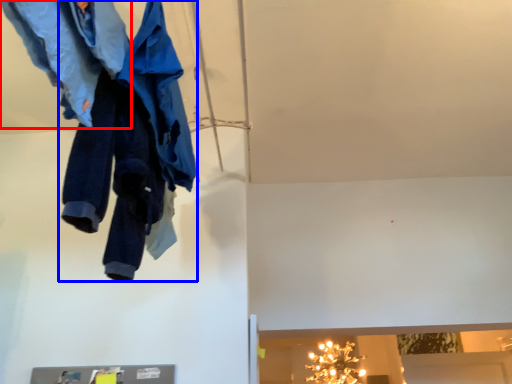
Question: Which of the following is the farthest to the observer, trousers (highlighted by a red box) or trousers (highlighted by a blue box)?

Choices:
 (A) trousers
 (B) trousers

Answer: (B)